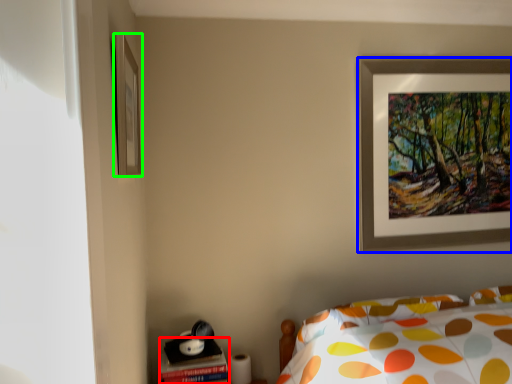
Question: Which is farther away from table (highlighted by a red box)? picture frame (highlighted by a blue box) or picture frame (highlighted by a green box)?

Choices:
 (A) picture frame
 (B) picture frame

Answer: (A)